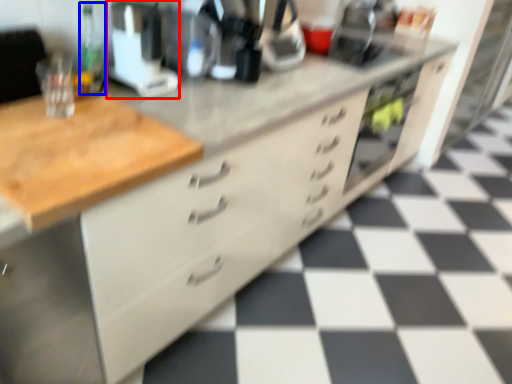
Question: Which of the following is the closest to the observer, appliance (highlighted by a red box) or bottle (highlighted by a blue box)?

Choices:
 (A) appliance
 (B) bottle

Answer: (A)